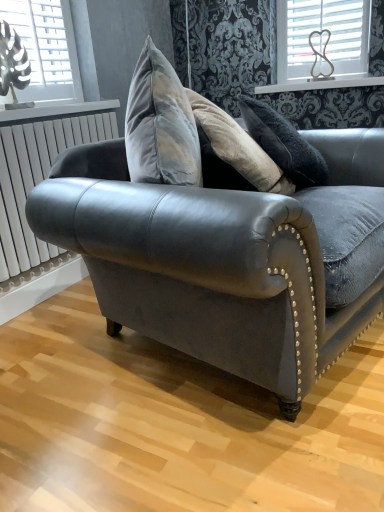
Question: Considering the relative sizes of white metallic radiator at left and metallic silver window at upper left, which is the first window in left-to-right order, in the image provided, is white metallic radiator at left taller than metallic silver window at upper left, which is the first window in left-to-right order,?

Choices:
 (A) yes
 (B) no

Answer: (A)

Question: Is white metallic radiator at left turned away from metallic silver window at upper left, which is counted as the second window, starting from the right?

Choices:
 (A) no
 (B) yes

Answer: (A)

Question: From a real-world perspective, is white metallic radiator at left physically above metallic silver window at upper left, which is counted as the second window, starting from the right?

Choices:
 (A) yes
 (B) no

Answer: (B)

Question: Does white metallic radiator at left have a larger size compared to metallic silver window at upper left, which is the first window in left-to-right order?

Choices:
 (A) no
 (B) yes

Answer: (B)

Question: Does white metallic radiator at left have a lesser height compared to metallic silver window at upper left, which is the 2th window from back to front?

Choices:
 (A) no
 (B) yes

Answer: (A)

Question: Does white metallic radiator at left come behind metallic silver window at upper left, which is the first window in left-to-right order?

Choices:
 (A) no
 (B) yes

Answer: (A)

Question: Is white glossy window sill at upper center wider than white plastic heart at upper right, which is the second window in front-to-back order?

Choices:
 (A) no
 (B) yes

Answer: (B)

Question: Is white glossy window sill at upper center smaller than white plastic heart at upper right, which is the second window in front-to-back order?

Choices:
 (A) yes
 (B) no

Answer: (B)

Question: Is white glossy window sill at upper center located outside white plastic heart at upper right, which appears as the first window when viewed from the back?

Choices:
 (A) no
 (B) yes

Answer: (B)

Question: Is white glossy window sill at upper center aimed at white plastic heart at upper right, which is the second window in front-to-back order?

Choices:
 (A) no
 (B) yes

Answer: (A)

Question: Is the surface of white glossy window sill at upper center in direct contact with white plastic heart at upper right, which is the second window in front-to-back order?

Choices:
 (A) no
 (B) yes

Answer: (A)

Question: Is white glossy window sill at upper center at the left side of white plastic heart at upper right, which is the second window in front-to-back order?

Choices:
 (A) yes
 (B) no

Answer: (A)

Question: Is metallic silver window at upper left, which is the first window in left-to-right order, aimed at white plastic heart at upper right, which appears as the first window when viewed from the back?

Choices:
 (A) yes
 (B) no

Answer: (B)